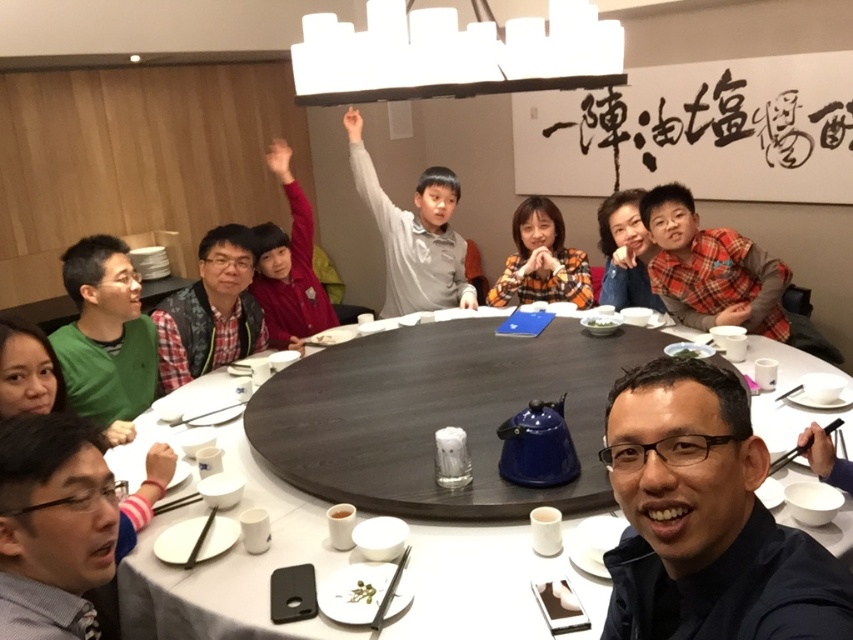
Can you confirm if green matte shirt at lower left is taller than orange plaid shirt at center?

Yes.

The width and height of the screenshot is (853, 640). Describe the element at coordinates (106, 337) in the screenshot. I see `green matte shirt at lower left` at that location.

Is point (148, 346) farther from camera compared to point (526, 236)?

No, it is in front of (526, 236).

Where is `green matte shirt at lower left`? This screenshot has width=853, height=640. green matte shirt at lower left is located at coordinates 106,337.

Who is lower down, black matte shirt at lower right or plaid fabric shirt at right?

black matte shirt at lower right

Can you confirm if black matte shirt at lower right is taller than plaid fabric shirt at right?

No, black matte shirt at lower right is not taller than plaid fabric shirt at right.

Which is behind, point (712, 552) or point (711, 289)?

Point (711, 289)

You are a GUI agent. You are given a task and a screenshot of the screen. Output one action in this format:
    pyautogui.click(x=<x>, y=<y>)
    Task: Click on the black matte shirt at lower right
    This screenshot has height=640, width=853.
    Given the screenshot: What is the action you would take?
    pyautogui.click(x=705, y=518)

Which is above, dark wood table at center or orange plaid shirt at center?

Positioned higher is orange plaid shirt at center.

Between dark wood table at center and orange plaid shirt at center, which one is positioned lower?

dark wood table at center is below.

You are a GUI agent. You are given a task and a screenshot of the screen. Output one action in this format:
    pyautogui.click(x=<x>, y=<y>)
    Task: Click on the dark wood table at center
    The width and height of the screenshot is (853, 640).
    Given the screenshot: What is the action you would take?
    pyautogui.click(x=518, y=515)

Locate an element on the screen. This screenshot has width=853, height=640. dark wood table at center is located at coordinates (518, 515).